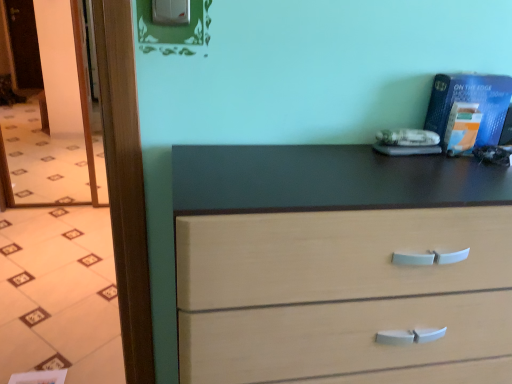
The width and height of the screenshot is (512, 384). I want to click on free location above light wood chest of drawers at center (from a real-world perspective), so click(354, 172).